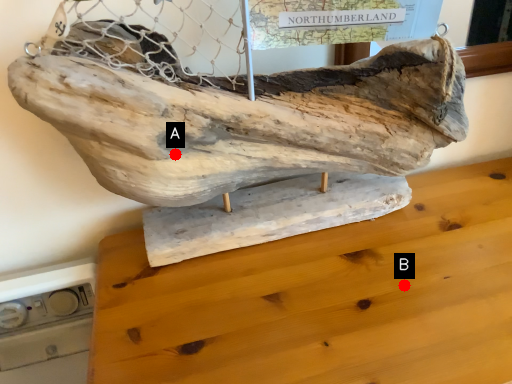
Question: Two points are circled on the image, labeled by A and B beside each circle. Which point is closer to the camera?

Choices:
 (A) A is closer
 (B) B is closer

Answer: (A)